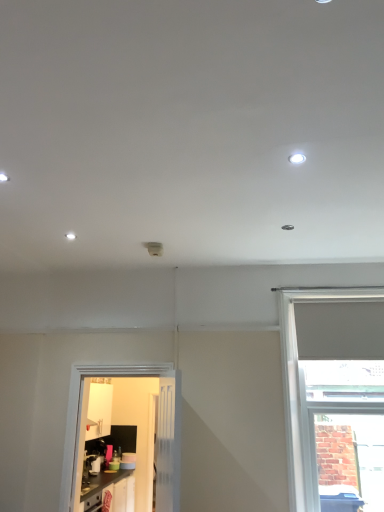
Locate an element on the screen. This screenshot has width=384, height=512. matte black cabinets at lower left is located at coordinates (100, 488).

Image resolution: width=384 pixels, height=512 pixels. What do you see at coordinates (100, 488) in the screenshot?
I see `matte black cabinets at lower left` at bounding box center [100, 488].

Locate an element on the screen. matte black cabinets at lower left is located at coordinates [x=100, y=488].

Between white matte window at right and white glossy door at lower left, which one appears on the left side from the viewer's perspective?

Positioned to the left is white glossy door at lower left.

Is white matte window at right not near white glossy door at lower left?

Yes, white matte window at right and white glossy door at lower left are quite far apart.

Is matte black cabinets at lower left situated inside white glossy door at lower left or outside?

matte black cabinets at lower left is not inside white glossy door at lower left, it's outside.

The height and width of the screenshot is (512, 384). Identify the location of door located in front of the matte black cabinets at lower left. (135, 434).

Does matte black cabinets at lower left have a smaller size compared to white glossy door at lower left?

No, matte black cabinets at lower left is not smaller than white glossy door at lower left.

Can you confirm if matte black cabinets at lower left is wider than white glossy door at lower left?

Indeed, matte black cabinets at lower left has a greater width compared to white glossy door at lower left.

From the image's perspective, which is above, matte black cabinets at lower left or white glossy light fixture at upper right?

white glossy light fixture at upper right appears higher in the image.

Is white glossy light fixture at upper right at the back of matte black cabinets at lower left?

matte black cabinets at lower left is not turned away from white glossy light fixture at upper right.

In the image, is matte black cabinets at lower left on the left side or the right side of white glossy light fixture at upper right?

matte black cabinets at lower left is positioned on white glossy light fixture at upper right's left side.

Is matte black cabinets at lower left positioned beyond the bounds of white glossy light fixture at upper right?

Yes.

From the image's perspective, is white glossy door at lower left on white glossy light fixture at upper right?

No, from the image's perspective, white glossy door at lower left is not on top of white glossy light fixture at upper right.

Would you say white glossy door at lower left is outside white glossy light fixture at upper right?

Absolutely, white glossy door at lower left is external to white glossy light fixture at upper right.

Which object is positioned more to the right, white glossy door at lower left or white glossy light fixture at upper right?

white glossy light fixture at upper right is more to the right.

Is white glossy door at lower left oriented away from white glossy light fixture at upper right?

That's not correct — white glossy door at lower left is not looking away from white glossy light fixture at upper right.

Is point (289, 160) positioned behind point (77, 462)?

No, (289, 160) is closer to viewer.

Can you tell me how much white glossy light fixture at upper right and white glossy door at lower left differ in facing direction?

The facing directions of white glossy light fixture at upper right and white glossy door at lower left are 89.5 degrees apart.

You are a GUI agent. You are given a task and a screenshot of the screen. Output one action in this format:
    pyautogui.click(x=<x>, y=<y>)
    Task: Click on the door below the white glossy light fixture at upper right (from the image's perspective)
    The height and width of the screenshot is (512, 384).
    Given the screenshot: What is the action you would take?
    pyautogui.click(x=135, y=434)

Based on the photo, is white glossy light fixture at upper right taller or shorter than white glossy door at lower left?

In the image, white glossy light fixture at upper right appears to be shorter than white glossy door at lower left.

Does point (300, 158) come in front of point (287, 451)?

Yes, it is in front of point (287, 451).

Is white glossy light fixture at upper right oriented towards white matte window at right?

No, white glossy light fixture at upper right is not facing towards white matte window at right.

Between white glossy light fixture at upper right and white matte window at right, which one has smaller size?

With smaller size is white glossy light fixture at upper right.

Between white glossy light fixture at upper right and white matte window at right, which one appears on the left side from the viewer's perspective?

From the viewer's perspective, white glossy light fixture at upper right appears more on the left side.

From a real-world perspective, is white matte window at right positioned over white glossy light fixture at upper right based on gravity?

No, from a real-world perspective, white matte window at right is not over white glossy light fixture at upper right

In terms of width, does white matte window at right look wider or thinner when compared to white glossy light fixture at upper right?

Clearly, white matte window at right has more width compared to white glossy light fixture at upper right.

Which object is closer to the camera taking this photo, white matte window at right or white glossy light fixture at upper right?

white glossy light fixture at upper right is in front.

Which of these two, white matte window at right or white glossy light fixture at upper right, stands taller?

white matte window at right.

At what (x,y) coordinates should I click in order to perform the action: click on window above the white glossy door at lower left (from the image's perspective). Please return your answer as a coordinate pair (x, y). Looking at the image, I should click on (305, 394).

Where is `cabinetry behind the white glossy door at lower left`? The height and width of the screenshot is (512, 384). cabinetry behind the white glossy door at lower left is located at coordinates (100, 488).

Based on their spatial positions, is white matte window at right or matte black cabinets at lower left further from white glossy light fixture at upper right?

matte black cabinets at lower left is positioned further to the anchor white glossy light fixture at upper right.

Looking at the image, which one is located further to white matte window at right, white glossy light fixture at upper right or white glossy door at lower left?

white glossy door at lower left is positioned further to the anchor white matte window at right.

Based on their spatial positions, is white matte window at right or white glossy door at lower left further from matte black cabinets at lower left?

Among the two, white matte window at right is located further to matte black cabinets at lower left.

When comparing their distances from white glossy light fixture at upper right, does white glossy door at lower left or white matte window at right seem further?

Among the two, white glossy door at lower left is located further to white glossy light fixture at upper right.

From the image, which object appears to be farther from white glossy door at lower left, matte black cabinets at lower left or white glossy light fixture at upper right?

white glossy light fixture at upper right lies further to white glossy door at lower left than the other object.

Based on their spatial positions, is white matte window at right or white glossy light fixture at upper right closer to matte black cabinets at lower left?

white matte window at right is closer to matte black cabinets at lower left.

Considering their positions, is white glossy light fixture at upper right positioned closer to matte black cabinets at lower left than white glossy door at lower left?

white glossy door at lower left is positioned closer to the anchor matte black cabinets at lower left.

From the image, which object appears to be nearer to white matte window at right, matte black cabinets at lower left or white glossy door at lower left?

matte black cabinets at lower left.

I want to click on window between white glossy light fixture at upper right and white glossy door at lower left vertically, so click(305, 394).

You are a GUI agent. You are given a task and a screenshot of the screen. Output one action in this format:
    pyautogui.click(x=<x>, y=<y>)
    Task: Click on the window between white glossy light fixture at upper right and matte black cabinets at lower left in the vertical direction
    
    Given the screenshot: What is the action you would take?
    pyautogui.click(x=305, y=394)

Where is `door between white glossy light fixture at upper right and matte black cabinets at lower left from top to bottom`? This screenshot has width=384, height=512. door between white glossy light fixture at upper right and matte black cabinets at lower left from top to bottom is located at coordinates (135, 434).

Where is `door located between white matte window at right and matte black cabinets at lower left in the depth direction`? door located between white matte window at right and matte black cabinets at lower left in the depth direction is located at coordinates (135, 434).